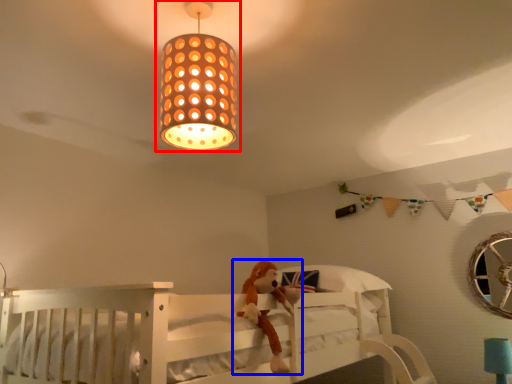
Question: Which object appears closest to the camera in this image, lamp (highlighted by a red box) or toy (highlighted by a blue box)?

Choices:
 (A) lamp
 (B) toy

Answer: (A)